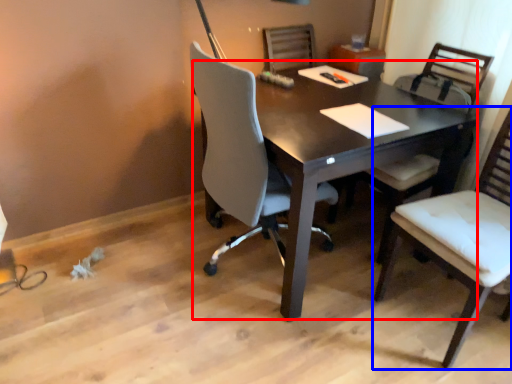
Question: Which point is further to the camera, desk (highlighted by a red box) or chair (highlighted by a blue box)?

Choices:
 (A) desk
 (B) chair

Answer: (A)